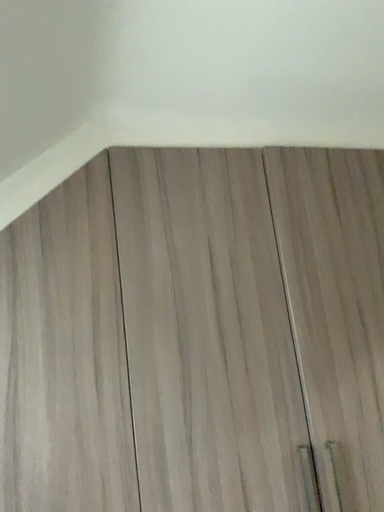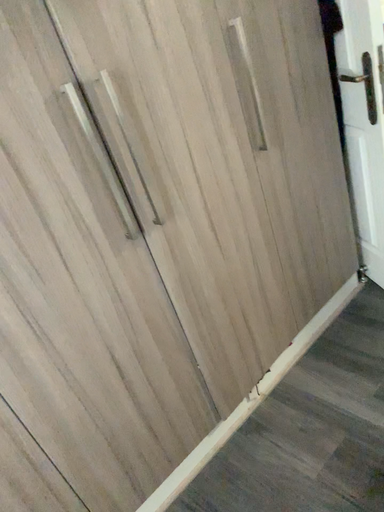
Question: Which way did the camera rotate in the video?

Choices:
 (A) rotated right
 (B) rotated left

Answer: (A)